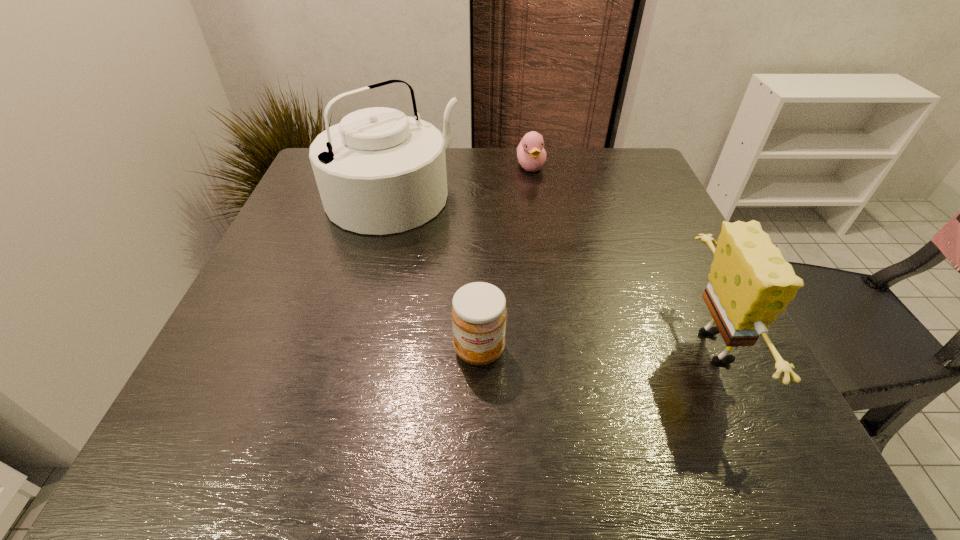
Identify the location of vacant space on the desktop that is between the jam and the rightmost object and is positioned on the front-facing side of the shortest object. The height and width of the screenshot is (540, 960). (608, 348).

I want to click on free spot on the desktop that is between the third object from right to left and the third shortest object and is positioned on the spout of the kettle, so click(x=579, y=348).